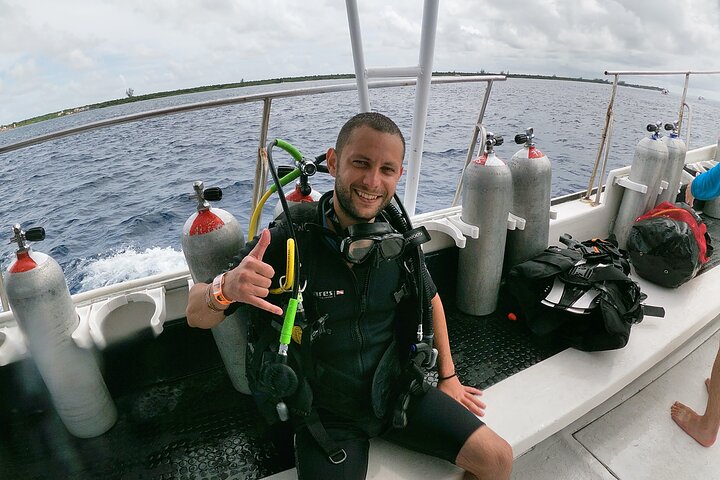
At what (x,y) coordinates should I click in order to perform the action: click on bench. Please return your answer as a coordinate pair (x, y). Image resolution: width=720 pixels, height=480 pixels. Looking at the image, I should click on (528, 373), (670, 306).